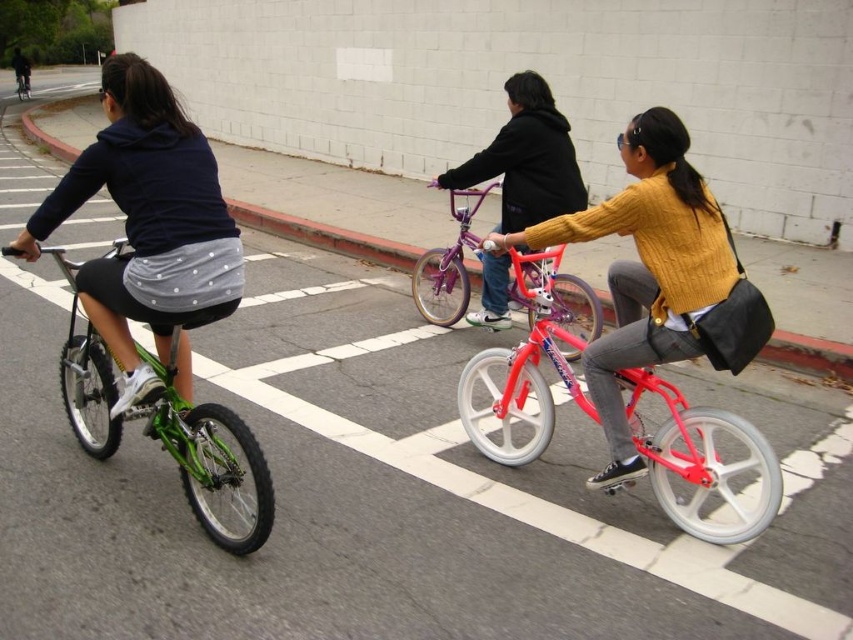
Question: Is matte purple bicycle at center to the left of green metallic bicycle at left from the viewer's perspective?

Choices:
 (A) no
 (B) yes

Answer: (A)

Question: Which of these objects is positioned closest to the green matte bicycle at left?

Choices:
 (A) green metallic bicycle at left
 (B) matte yellow sweater at center
 (C) metallic purple bicycle at center

Answer: (B)

Question: Is matte black hoodie at upper left positioned at the back of matte yellow sweater at center?

Choices:
 (A) yes
 (B) no

Answer: (A)

Question: Which object is the farthest from the metallic purple bicycle at center?

Choices:
 (A) green metallic bicycle at left
 (B) matte yellow sweater at center
 (C) shiny pink bicycle at center

Answer: (A)

Question: Which object is the farthest from the matte black hoodie at upper left?

Choices:
 (A) matte purple bicycle at center
 (B) green matte bicycle at left
 (C) shiny pink bicycle at center

Answer: (A)

Question: Is matte purple bicycle at center above metallic purple bicycle at center?

Choices:
 (A) no
 (B) yes

Answer: (B)